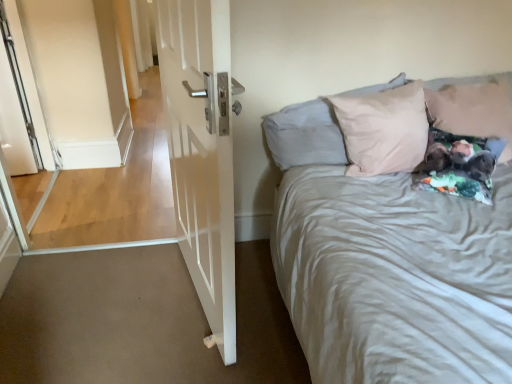
The height and width of the screenshot is (384, 512). What are the coordinates of `vacant area that is in front of white glossy door at left` in the screenshot? It's located at (172, 350).